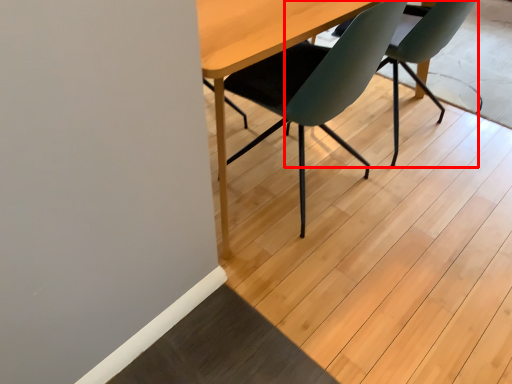
Question: From the image's perspective, where is chair (annotated by the red box) located relative to chair?

Choices:
 (A) above
 (B) below

Answer: (A)